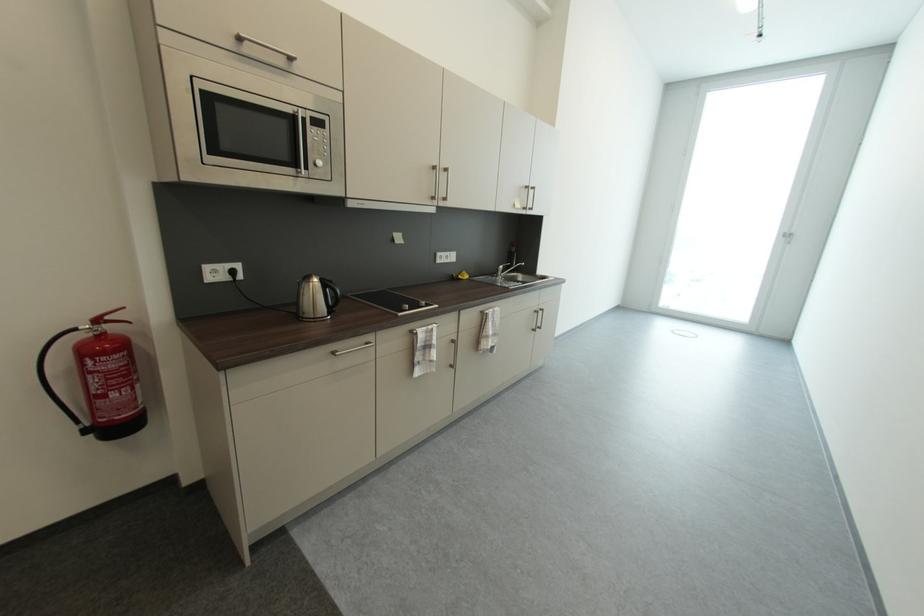
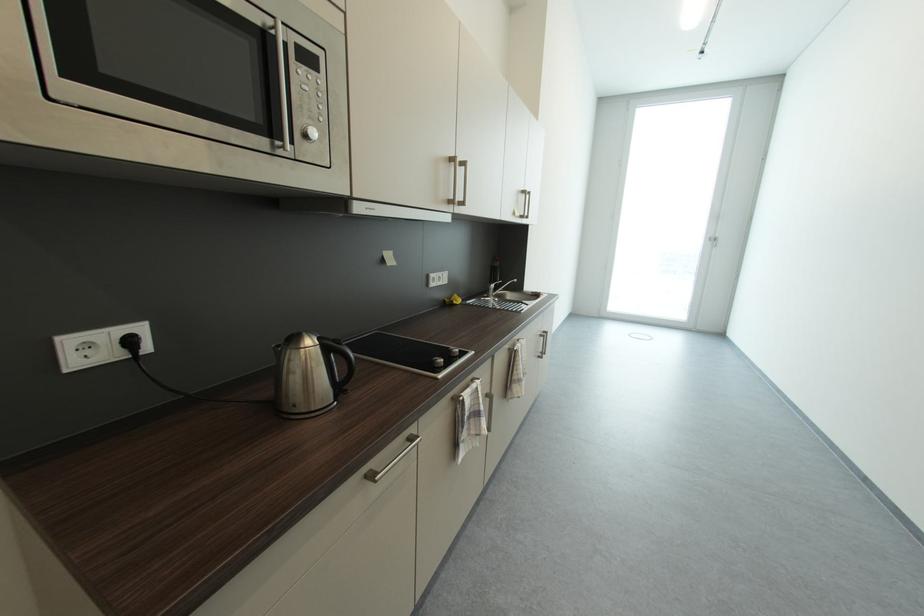
Question: The first image is from the beginning of the video and the second image is from the end. How did the camera likely rotate when shooting the video?

Choices:
 (A) Left
 (B) Right
 (C) Up
 (D) Down

Answer: (B)